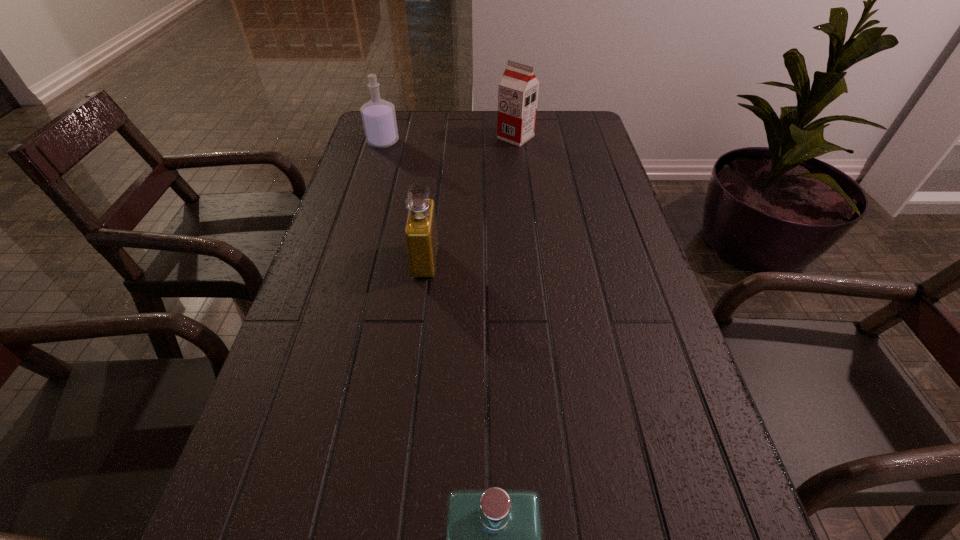
Locate an element on the screen. object that is positioned at the left edge is located at coordinates (379, 119).

Where is `object located at the far left corner`? The image size is (960, 540). object located at the far left corner is located at coordinates (379, 119).

Locate an element on the screen. This screenshot has height=540, width=960. blank space at the far edge of the desktop is located at coordinates (441, 138).

At what (x,y) coordinates should I click in order to perform the action: click on vacant space at the left edge of the desktop. Please return your answer as a coordinate pair (x, y). Image resolution: width=960 pixels, height=540 pixels. Looking at the image, I should click on (369, 158).

You are a GUI agent. You are given a task and a screenshot of the screen. Output one action in this format:
    pyautogui.click(x=<x>, y=<y>)
    Task: Click on the vacant space at the right edge of the desktop
    
    Given the screenshot: What is the action you would take?
    coord(636,272)

At what (x,y) coordinates should I click in order to perform the action: click on vacant space at the far right corner. Please return your answer as a coordinate pair (x, y). Looking at the image, I should click on (552, 123).

Locate an element on the screen. This screenshot has height=540, width=960. empty space between the leftmost perfume and the soya milk is located at coordinates (449, 139).

Where is `free space between the third object from right to left and the leftmost perfume`? This screenshot has width=960, height=540. free space between the third object from right to left and the leftmost perfume is located at coordinates [404, 201].

At what (x,y) coordinates should I click in order to perform the action: click on free point between the leftmost object and the second nearest object. Please return your answer as a coordinate pair (x, y). Looking at the image, I should click on (404, 201).

Where is `free space between the soya milk and the second farthest perfume`? The image size is (960, 540). free space between the soya milk and the second farthest perfume is located at coordinates (470, 199).